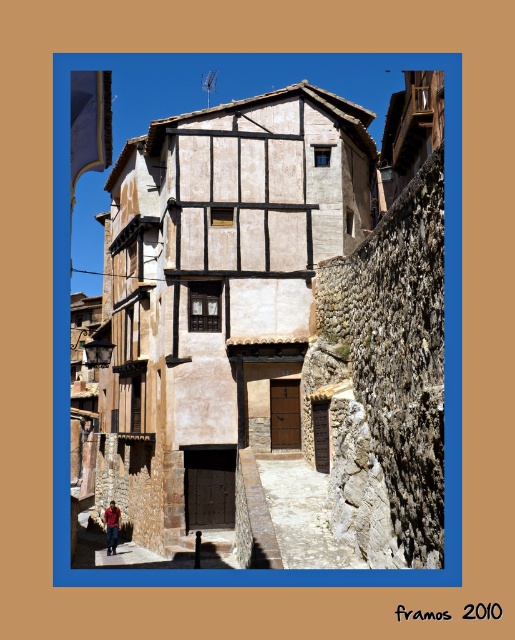
Question: From the image, what is the correct spatial relationship of brown wooden house at center in relation to red cotton shirt at lower left?

Choices:
 (A) above
 (B) below

Answer: (A)

Question: Does brown wooden house at center have a smaller size compared to red cotton shirt at lower left?

Choices:
 (A) yes
 (B) no

Answer: (B)

Question: Does brown wooden house at center appear under red cotton shirt at lower left?

Choices:
 (A) yes
 (B) no

Answer: (B)